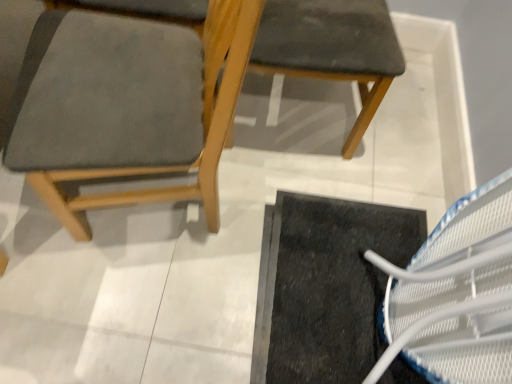
Question: From their relative heights in the image, would you say matte gray cushion at upper right, the 2th chair from the left, is taller or shorter than black rubber doormat at lower right?

Choices:
 (A) short
 (B) tall

Answer: (B)

Question: From a real-world perspective, is matte gray cushion at upper right, marked as the first chair in a right-to-left arrangement, physically located above or below black rubber doormat at lower right?

Choices:
 (A) above
 (B) below

Answer: (A)

Question: Considering the real-world distances, which object is farthest from the matte gray fabric chair at left, which is the 2th chair from right to left?

Choices:
 (A) black rubber doormat at lower right
 (B) matte gray cushion at upper right, marked as the first chair in a right-to-left arrangement

Answer: (A)

Question: Considering the real-world distances, which object is farthest from the black rubber doormat at lower right?

Choices:
 (A) matte gray cushion at upper right, the 2th chair from the left
 (B) matte gray fabric chair at left, which is the 2th chair from right to left

Answer: (B)